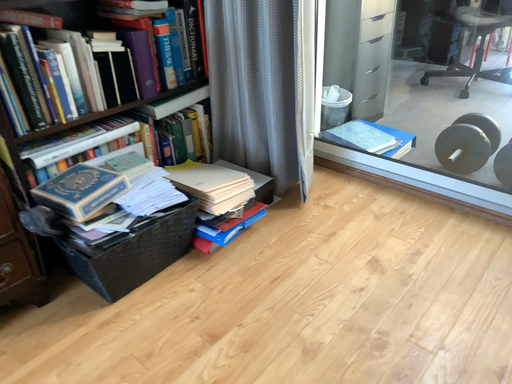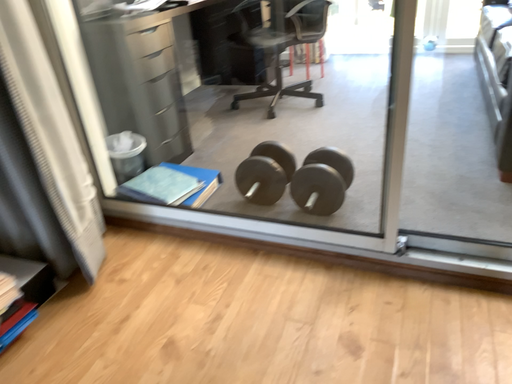
Question: Which way did the camera rotate in the video?

Choices:
 (A) rotated left
 (B) rotated right

Answer: (B)